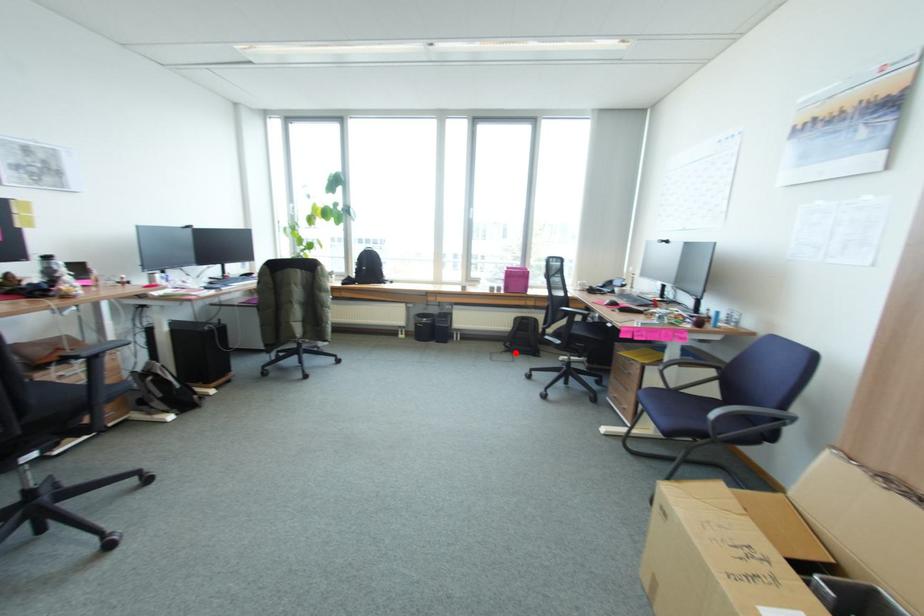
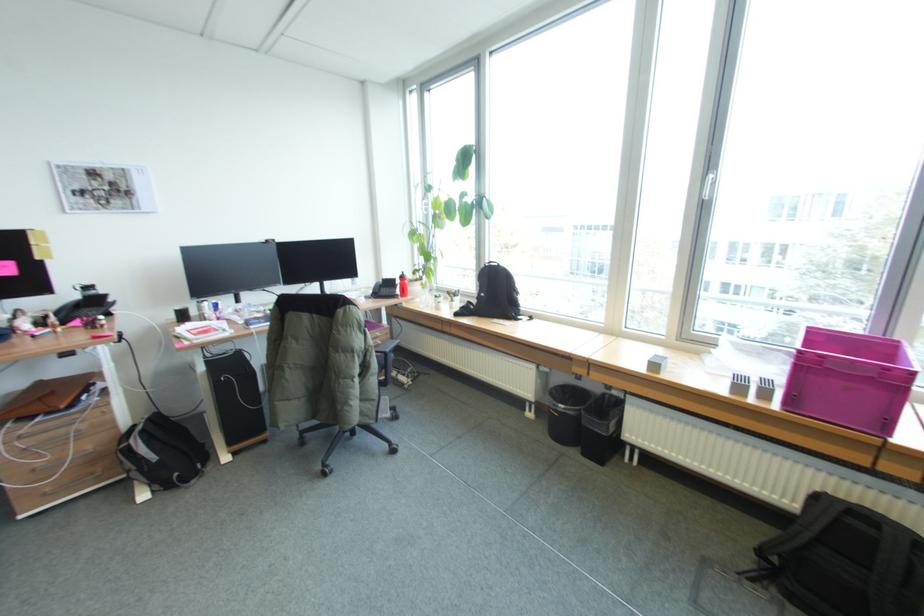
Question: I am providing you with two images of the same scene from different viewpoints. A red point is marked on the first image. Is the red point's position out of view in image 2?

Choices:
 (A) Yes
 (B) No

Answer: (B)